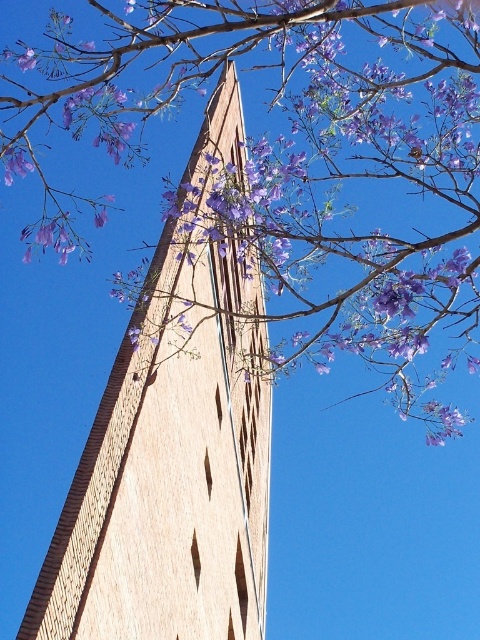
You are standing in front of the light brown brick tower at center and want to get a clear view of its facade. What should you do to avoid the obstruction caused by the purple leafy branches at upper center?

Move to the right side of the purple leafy branches at upper center so that the light brown brick tower at center is visible without obstruction.